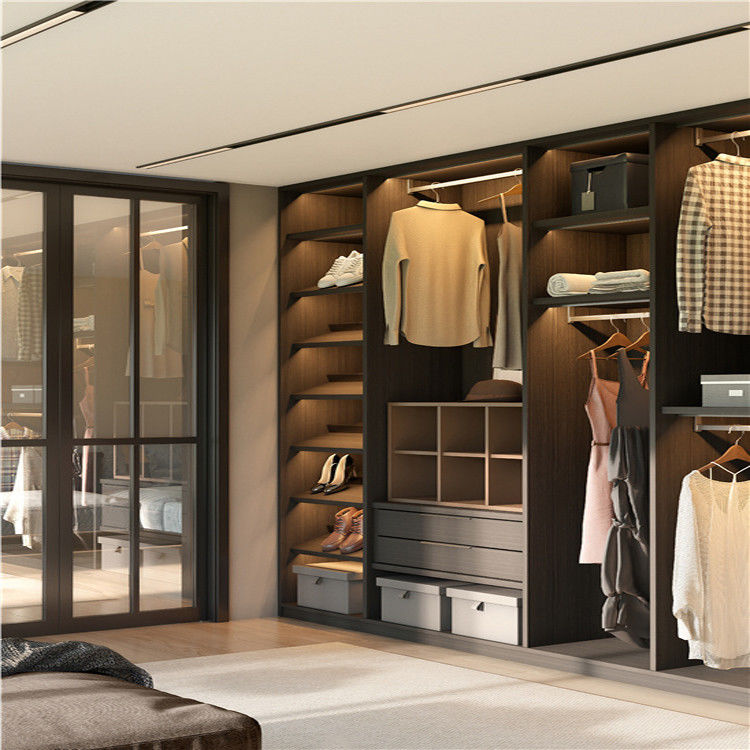
Find the location of a particular element. folded white towels is located at coordinates (571, 282), (620, 277).